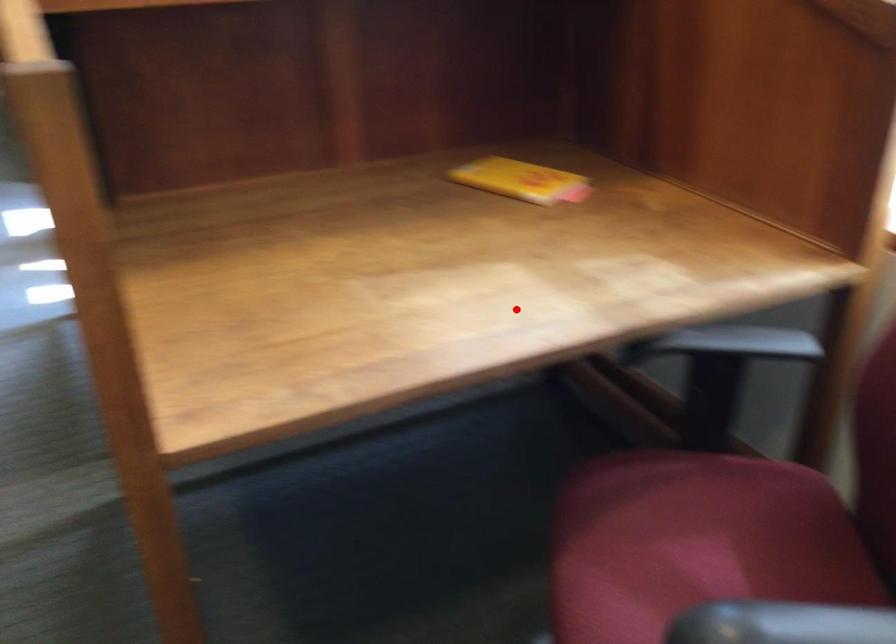
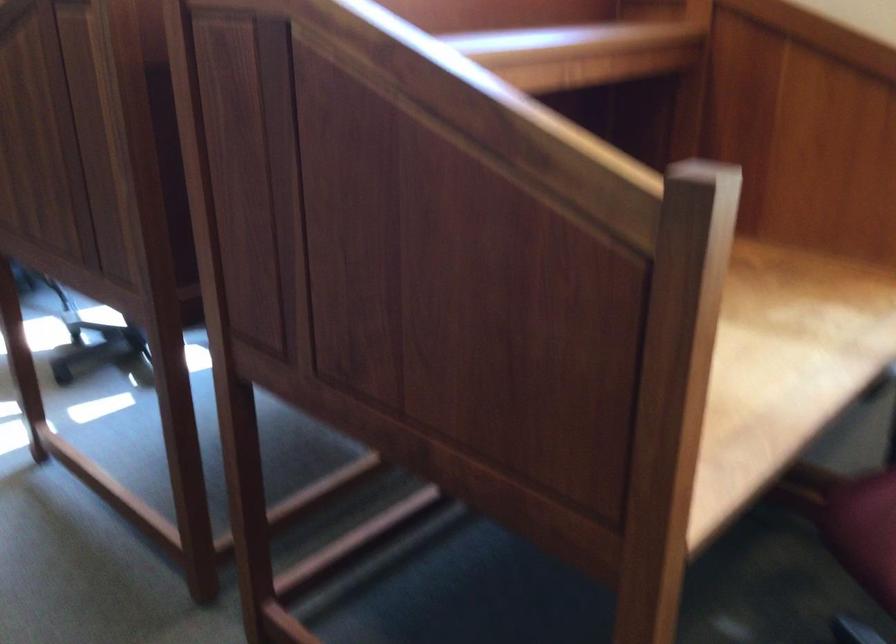
Question: I am providing you with two images of the same scene from different viewpoints. A red point is marked on the first image. At the location where the point appears in image 1, is it still visible in image 2?

Choices:
 (A) Yes
 (B) No

Answer: (A)